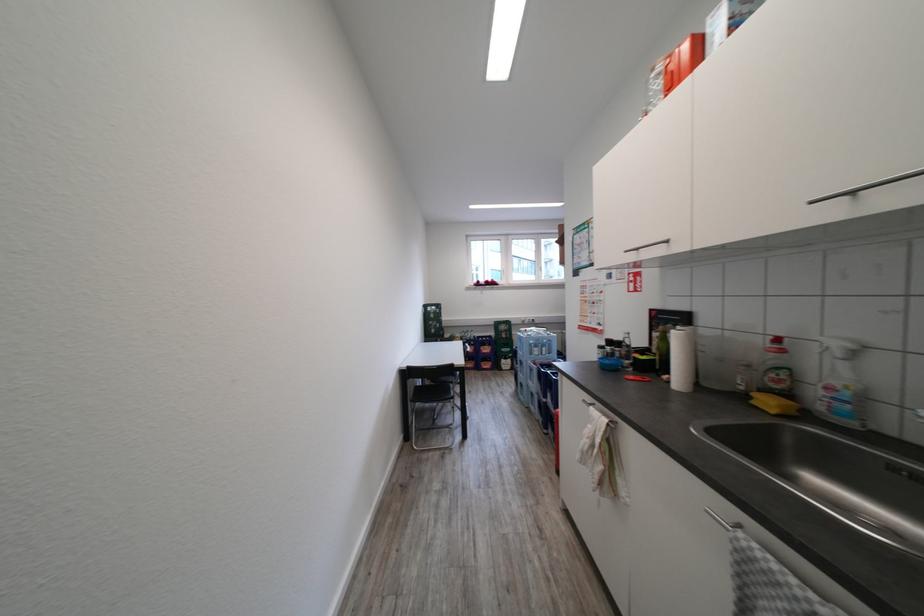
Where would you pull the spray bottle trigger? Please return your answer as a coordinate pair (x, y).

(835, 339)